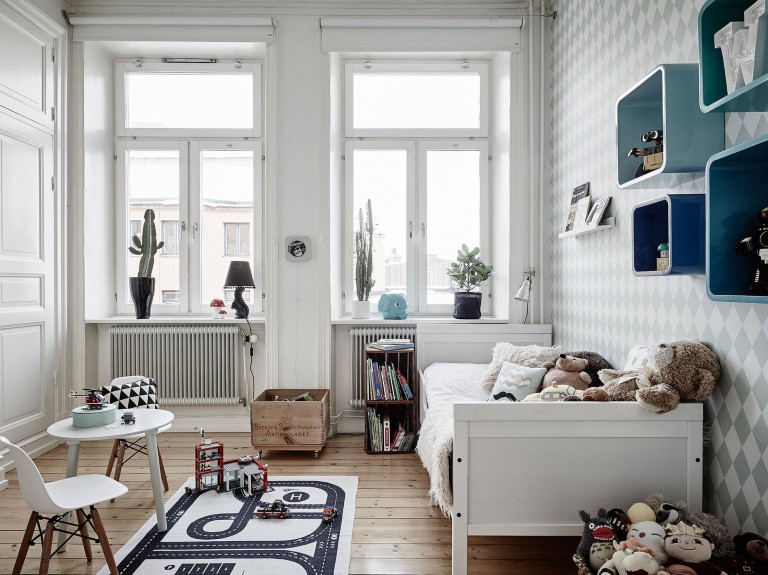
What are the coordinates of `heater` in the screenshot? It's located at (204, 359), (358, 348).